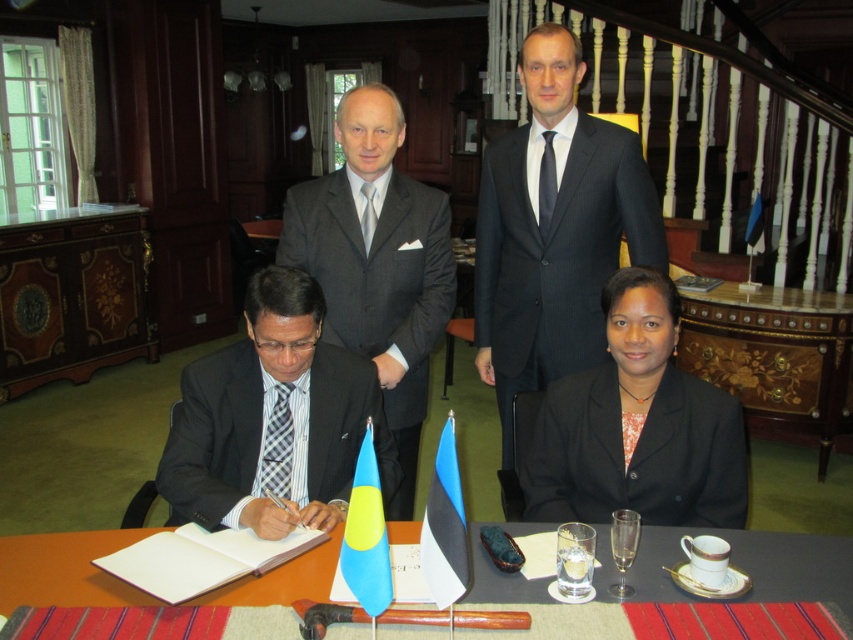
Question: Which is nearer to the dark gray pinstripe suit at upper center?

Choices:
 (A) matte black suit at lower left
 (B) plaid fabric tie at lower left

Answer: (A)

Question: Where is wooden table at lower center located in relation to black silk tie at upper center in the image?

Choices:
 (A) above
 (B) below

Answer: (B)

Question: Is blue fabric flag at center wider than black silk tie at upper center?

Choices:
 (A) no
 (B) yes

Answer: (B)

Question: Which of the following is the farthest from the observer?

Choices:
 (A) plaid fabric tie at lower left
 (B) blue fabric flag at center
 (C) blue fabric flag at lower center
 (D) matte black suit at lower left

Answer: (A)

Question: Is dark gray suit at upper center thinner than blue fabric flag at center?

Choices:
 (A) no
 (B) yes

Answer: (A)

Question: Which object is farther from the camera taking this photo?

Choices:
 (A) wooden table at lower center
 (B) black silk tie at upper center
 (C) dark gray suit at upper center

Answer: (B)